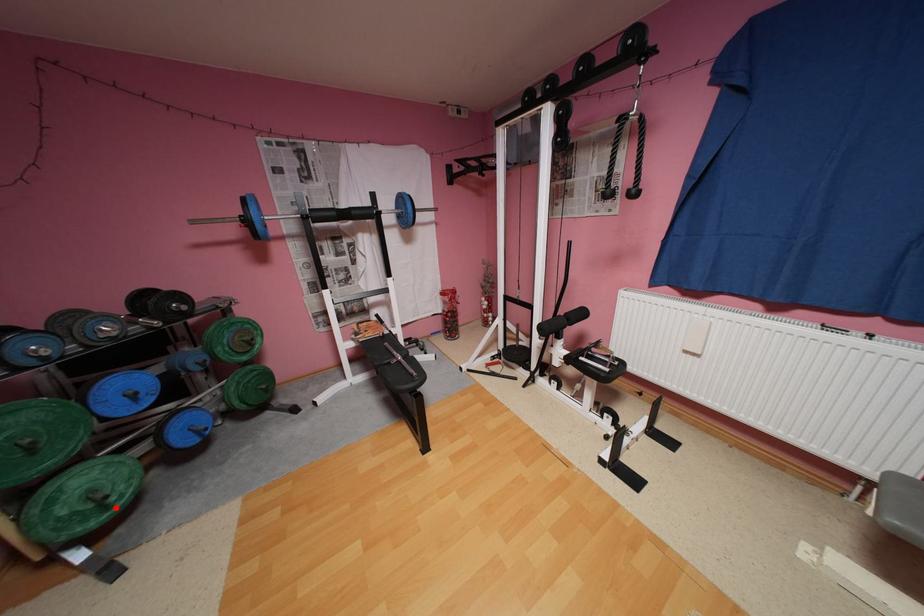
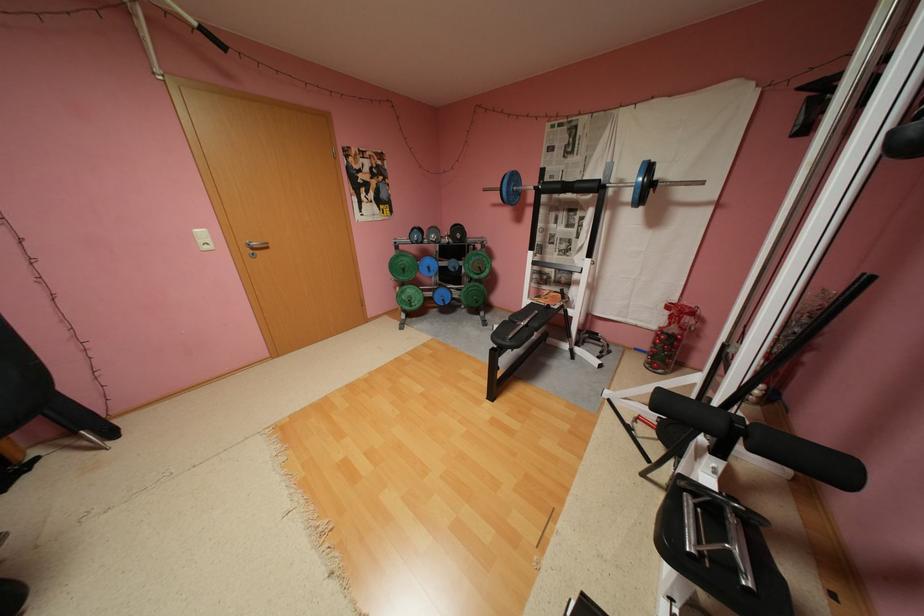
Question: I am providing you with two images of the same scene from different viewpoints. A red point is shown in image1. For the corresponding object point in image2, is it positioned nearer or farther from the camera?

Choices:
 (A) Nearer
 (B) Farther

Answer: (B)